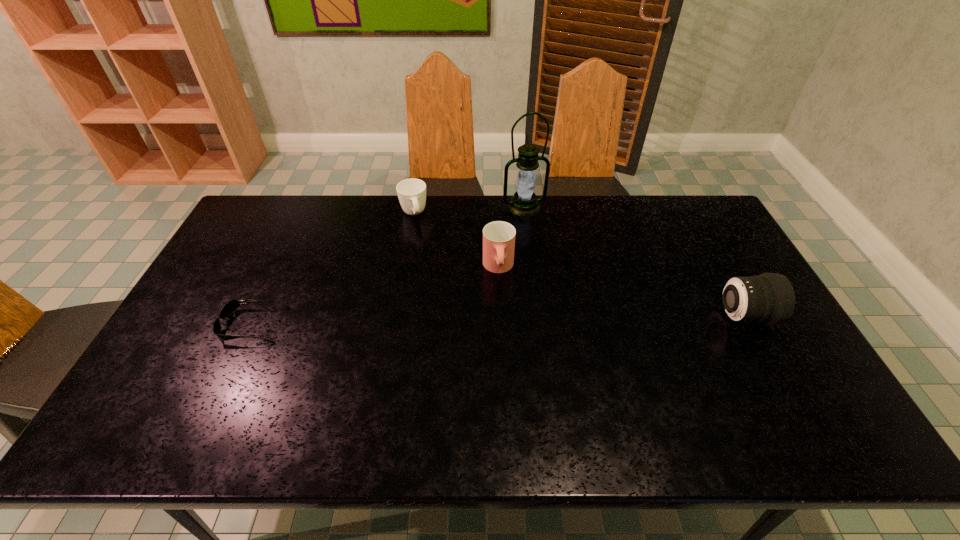
Identify the location of free spot between the telephoto lens and the right cup. (620, 292).

You are a GUI agent. You are given a task and a screenshot of the screen. Output one action in this format:
    pyautogui.click(x=<x>, y=<y>)
    Task: Click on the free space between the leftmost object and the taller cup
    
    Given the screenshot: What is the action you would take?
    pyautogui.click(x=375, y=296)

The height and width of the screenshot is (540, 960). In order to click on free spot between the leftmost object and the telephoto lens in this screenshot , I will do `click(498, 321)`.

This screenshot has height=540, width=960. In order to click on vacant space in between the taller cup and the farther cup in this screenshot , I will do `click(456, 241)`.

Identify the location of free space between the tallest object and the sunglasses. [389, 266].

Locate an element on the screen. The height and width of the screenshot is (540, 960). free spot between the shorter cup and the taller cup is located at coordinates (456, 241).

I want to click on vacant point located between the shorter cup and the rightmost object, so click(578, 265).

At what (x,y) coordinates should I click in order to perform the action: click on object that is the fourth closest to the rightmost object. Please return your answer as a coordinate pair (x, y). Looking at the image, I should click on (232, 305).

This screenshot has width=960, height=540. What are the coordinates of `object identified as the third closest to the leftmost object` in the screenshot? It's located at (524, 203).

Locate an element on the screen. free location that satisfies the following two spatial constraints: 1. on the front side of the rightmost object; 2. at the front element of the tallest object is located at coordinates (537, 316).